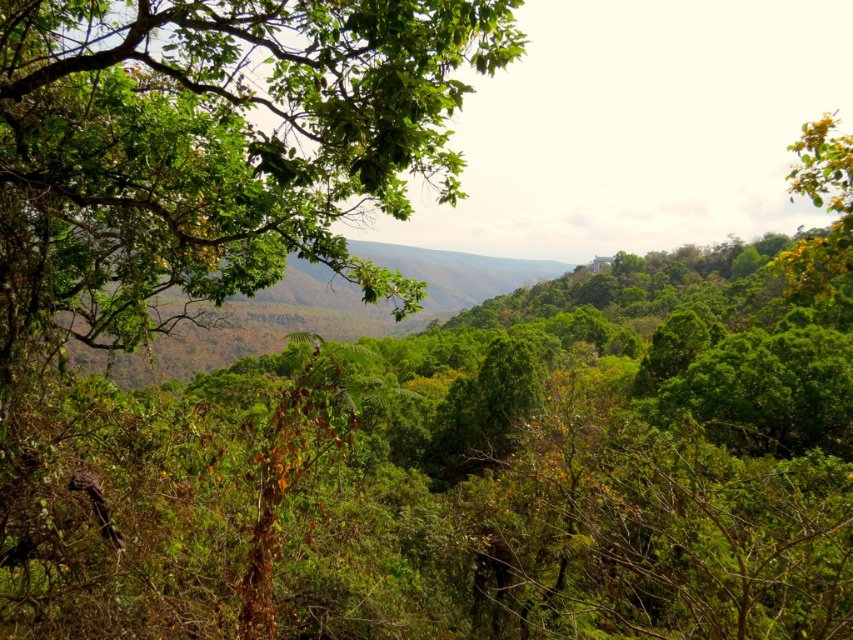
You are navigating through the forest and see two points marked in the image. Which point is closer to you, point (236, 8) or point (816, 125)?

Point (236, 8) is in front of point (816, 125), so it is closer to you.